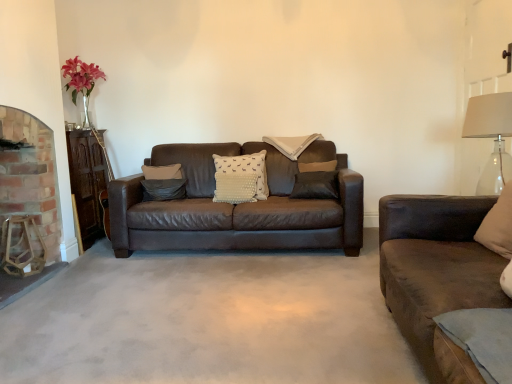
Question: Considering the positions of suede pillow at center, arranged as the second pillow when viewed from the back, and clear glass lampshade at right in the image, is suede pillow at center, arranged as the second pillow when viewed from the back, taller or shorter than clear glass lampshade at right?

Choices:
 (A) short
 (B) tall

Answer: (A)

Question: Relative to clear glass lampshade at right, is suede pillow at center, which ranks as the fourth pillow in right-to-left order, in front or behind?

Choices:
 (A) behind
 (B) front

Answer: (A)

Question: Which object is the closest to the brick fireplace at left?

Choices:
 (A) suede pillow at center, the 3th pillow when ordered from front to back
 (B) white dotted fabric pillow at center, arranged as the third pillow when viewed from the right
 (C) beige fabric pillow at right, the 4th pillow in the left-to-right sequence
 (D) white dotted pillow at center, the 1th pillow from the back
 (E) clear glass lampshade at right

Answer: (A)

Question: Which is nearer to the white dotted fabric pillow at center, arranged as the third pillow when viewed from the right?

Choices:
 (A) beige fabric pillow at right, which ranks as the first pillow in right-to-left order
 (B) clear glass lampshade at right
 (C) brick fireplace at left
 (D) suede pillow at center, which ranks as the fourth pillow in right-to-left order
 (E) white dotted pillow at center, the 3th pillow in the left-to-right sequence

Answer: (E)